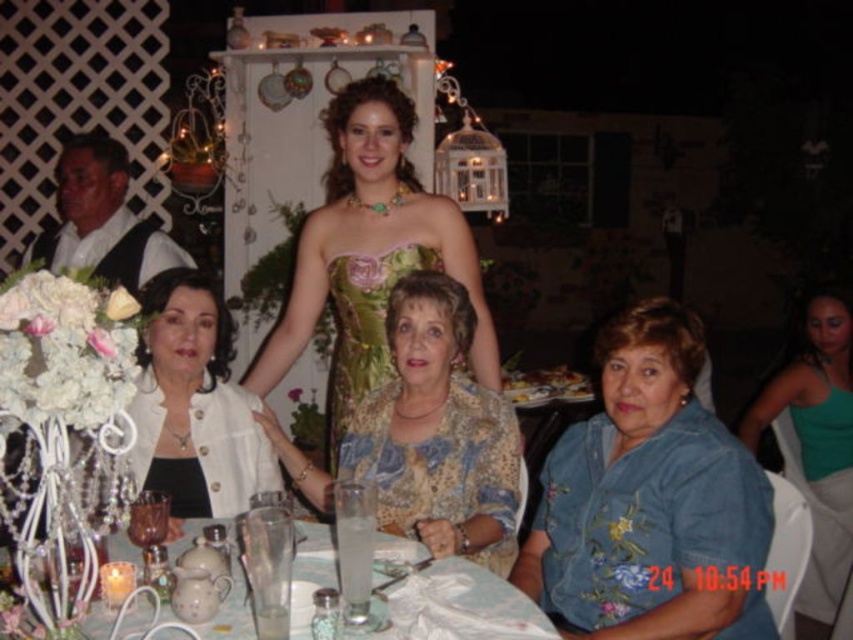
Which is more to the left, green satin dress at center or printed silk blouse at center?

Positioned to the left is green satin dress at center.

Can you confirm if green satin dress at center is shorter than printed silk blouse at center?

Incorrect, green satin dress at center's height does not fall short of printed silk blouse at center's.

Which is behind, point (357, 323) or point (468, 404)?

Positioned behind is point (357, 323).

This screenshot has width=853, height=640. Identify the location of green satin dress at center. (369, 253).

Which is in front, point (569, 426) or point (410, 252)?

Point (569, 426)

Which is above, blue floral blouse at lower right or floral-patterned fabric dress at center?

floral-patterned fabric dress at center is above.

What do you see at coordinates (650, 500) in the screenshot? This screenshot has height=640, width=853. I see `blue floral blouse at lower right` at bounding box center [650, 500].

Find the location of a particular element. Image resolution: width=853 pixels, height=640 pixels. blue floral blouse at lower right is located at coordinates (650, 500).

Is point (474, 513) closer to camera compared to point (334, 378)?

Yes, point (474, 513) is closer to viewer.

Is printed silk blouse at center shorter than floral-patterned fabric dress at center?

No, printed silk blouse at center is not shorter than floral-patterned fabric dress at center.

At what (x,y) coordinates should I click in order to perform the action: click on printed silk blouse at center. Please return your answer as a coordinate pair (x, y). The height and width of the screenshot is (640, 853). Looking at the image, I should click on (428, 435).